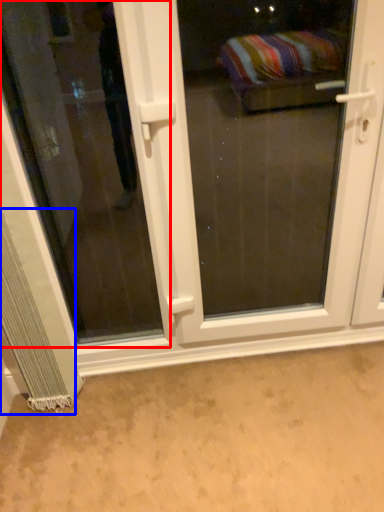
Question: Which object is further to the camera taking this photo, window (highlighted by a red box) or curtain (highlighted by a blue box)?

Choices:
 (A) window
 (B) curtain

Answer: (B)